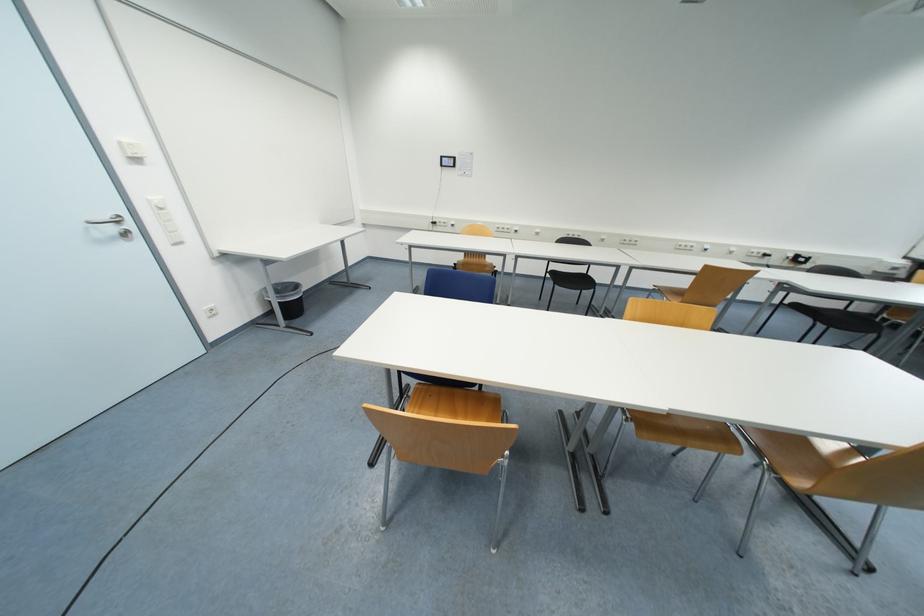
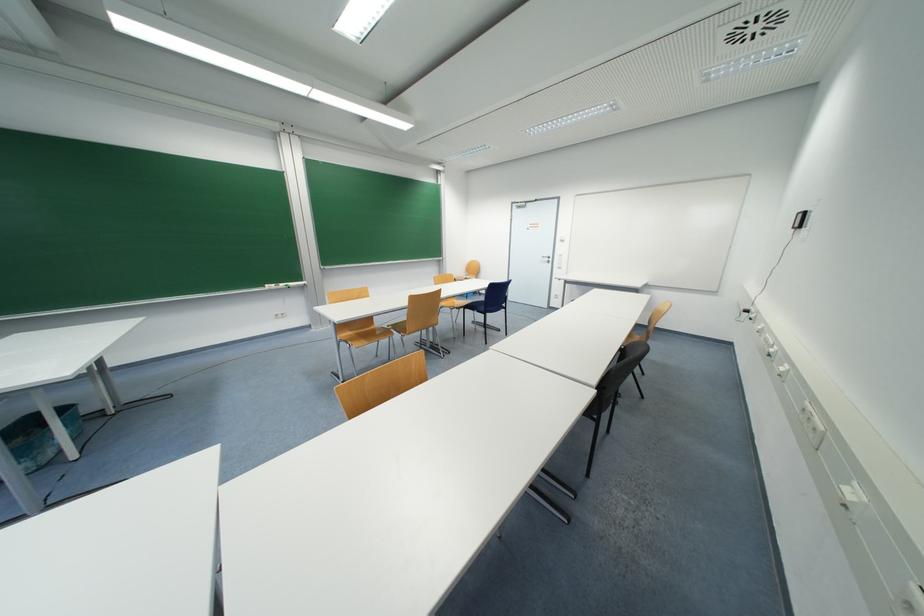
Question: I am providing you with two images of the same scene from different viewpoints. Please identify which objects are invisible in image2.

Choices:
 (A) blue chair sitting surface
 (B) black trash can
 (C) white board eraser
 (D) small cabinet lock

Answer: (B)